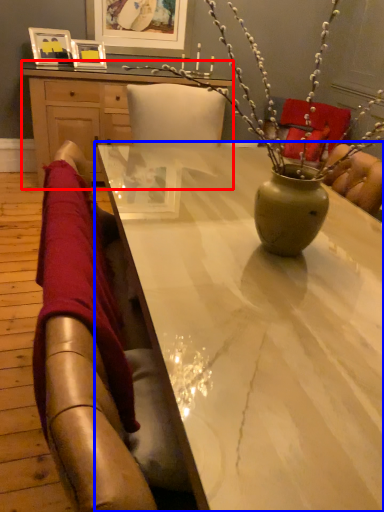
Question: Which object appears farthest to the camera in this image, desk (highlighted by a red box) or table (highlighted by a blue box)?

Choices:
 (A) desk
 (B) table

Answer: (A)